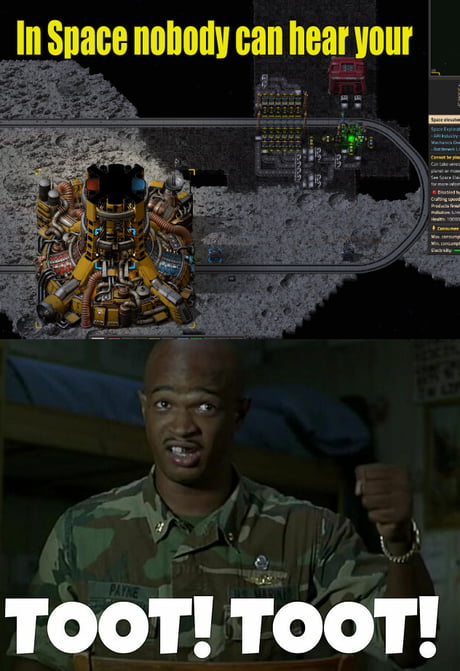
The width and height of the screenshot is (460, 671). What are the coordinates of `chest` in the screenshot? It's located at (149, 558).